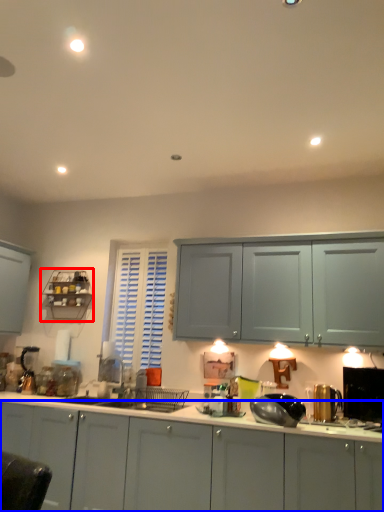
Question: Which of the following is the farthest to the observer, shelf (highlighted by a red box) or cabinetry (highlighted by a blue box)?

Choices:
 (A) shelf
 (B) cabinetry

Answer: (A)